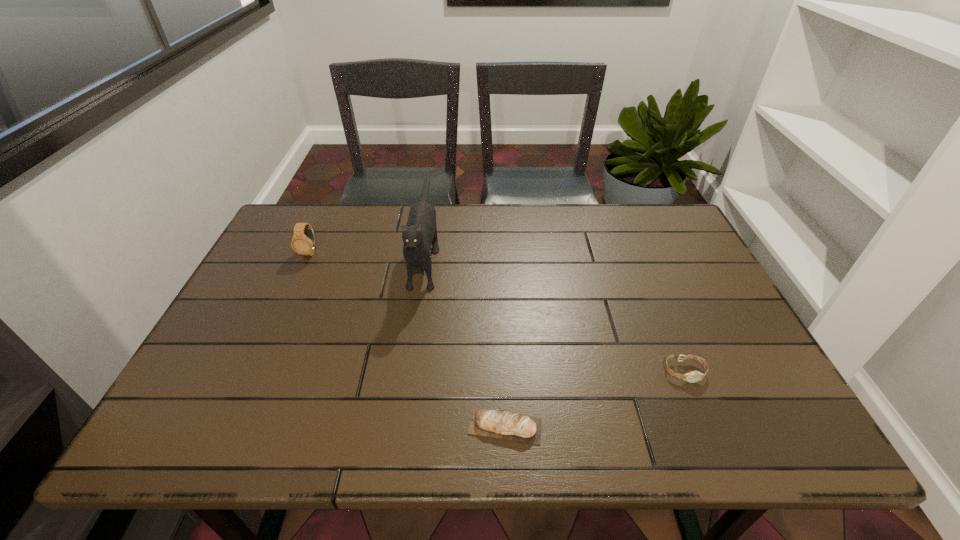
Locate an element on the screen. The height and width of the screenshot is (540, 960). free space located 0.050m on the face of the shorter watch is located at coordinates (697, 403).

Find the location of a particular element. free spot located on the back of the pita bread is located at coordinates (498, 282).

Identify the location of cat located at the far edge. (420, 232).

Locate an element on the screen. The image size is (960, 540). watch that is at the far edge is located at coordinates (303, 242).

At what (x,y) coordinates should I click in order to perform the action: click on object positioned at the near edge. Please return your answer as a coordinate pair (x, y). This screenshot has width=960, height=540. Looking at the image, I should click on (505, 425).

Locate an element on the screen. The width and height of the screenshot is (960, 540). object located in the left edge section of the desktop is located at coordinates (303, 242).

Identify the location of object present at the right edge. This screenshot has width=960, height=540. (694, 376).

Find the location of `object at the far left corner`. object at the far left corner is located at coordinates (303, 242).

The image size is (960, 540). What are the coordinates of `free space at the far edge of the desktop` in the screenshot? It's located at (591, 244).

In the image, there is a desktop. Where is `vacant space at the near edge`? vacant space at the near edge is located at coordinates click(682, 448).